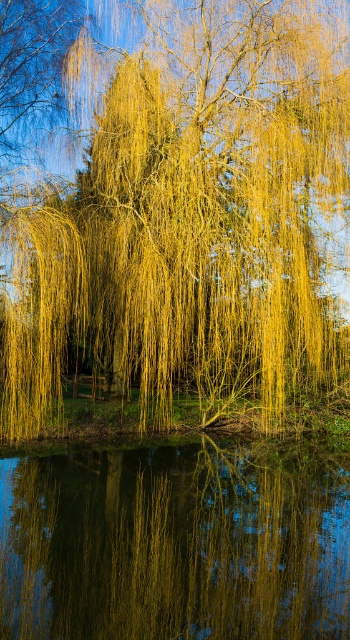
You are standing 10 meters away from the weeping willow tree in the scene. You want to walk towards the point marked at coordinates point (312, 477). Will you need to move closer or farther away from the tree?

The distance of point (312, 477) from viewer is 10.94 meters, so you are currently 10 meters away from the tree. Since the point is farther away than your current position, you need to move farther away from the tree to reach it.